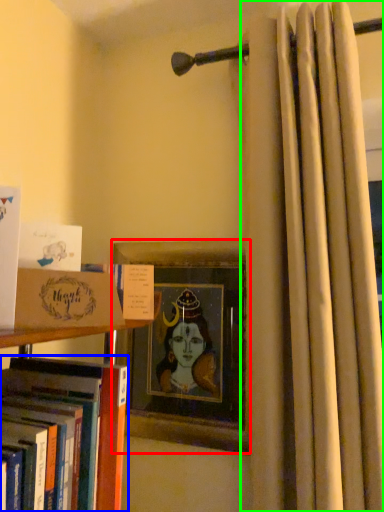
Question: Considering the real-world distances, which object is closest to picture frame (highlighted by a red box)? book (highlighted by a blue box) or curtain (highlighted by a green box).

Choices:
 (A) book
 (B) curtain

Answer: (B)